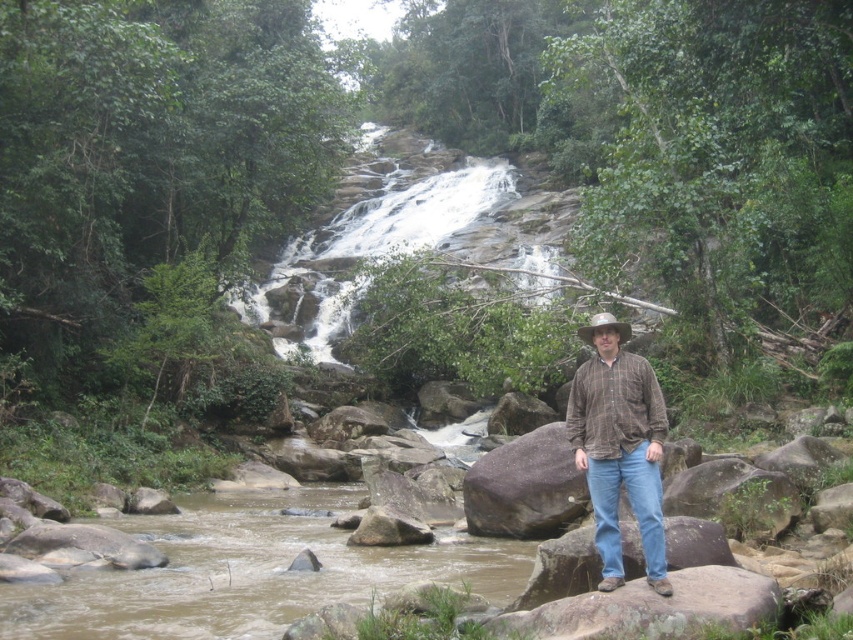
Question: Is brown plaid shirt at center bigger than brown woven cowboy hat at center?

Choices:
 (A) no
 (B) yes

Answer: (A)

Question: Can you confirm if brown plaid shirt at center is thinner than brown woven cowboy hat at center?

Choices:
 (A) yes
 (B) no

Answer: (A)

Question: Which point appears farthest from the camera in this image?

Choices:
 (A) (631, 388)
 (B) (585, 336)

Answer: (B)

Question: Is brown plaid shirt at center above brown woven cowboy hat at center?

Choices:
 (A) yes
 (B) no

Answer: (B)

Question: Which point is farther to the camera?

Choices:
 (A) brown woven cowboy hat at center
 (B) brown plaid shirt at center

Answer: (A)